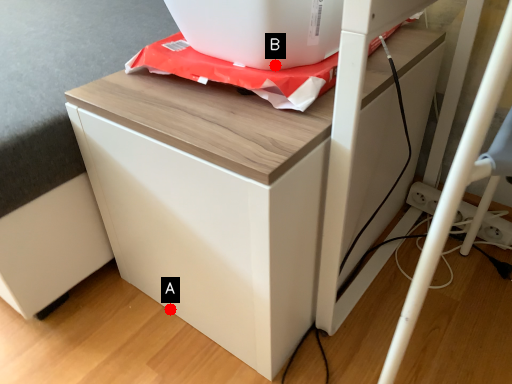
Question: Two points are circled on the image, labeled by A and B beside each circle. Which point is farther to the camera?

Choices:
 (A) A is further
 (B) B is further

Answer: (A)